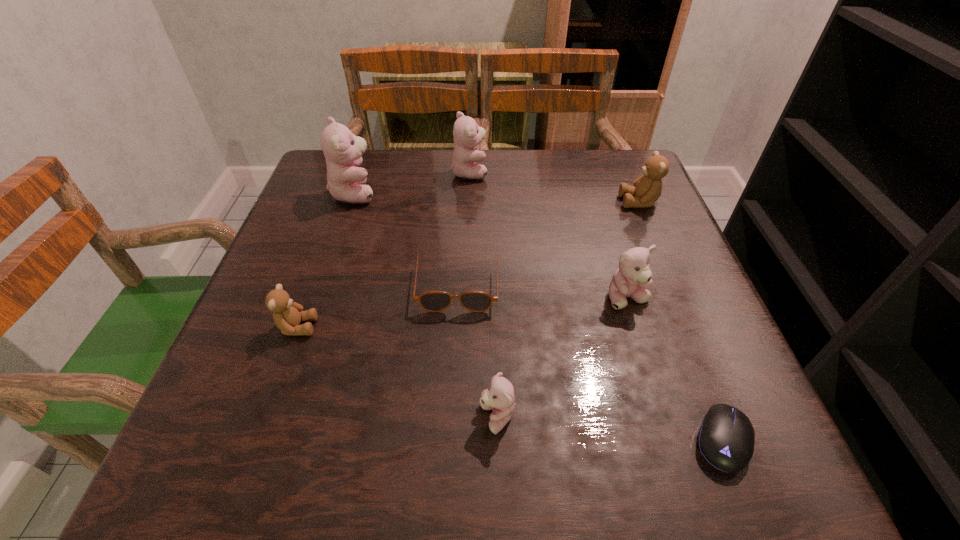
At what (x,y) coordinates should I click in order to perform the action: click on computer mouse located at the right edge. Please return your answer as a coordinate pair (x, y). Looking at the image, I should click on (726, 437).

You are a GUI agent. You are given a task and a screenshot of the screen. Output one action in this format:
    pyautogui.click(x=<x>, y=<y>)
    Task: Click on the object located at the far left corner
    
    Given the screenshot: What is the action you would take?
    pyautogui.click(x=343, y=151)

The width and height of the screenshot is (960, 540). What are the coordinates of `object that is at the far right corner` in the screenshot? It's located at tap(646, 190).

Locate an element on the screen. object present at the near right corner is located at coordinates (726, 437).

The image size is (960, 540). Find the location of `free spot at the far edge of the desktop`. free spot at the far edge of the desktop is located at coordinates (545, 164).

In the image, there is a desktop. Where is `vacant space at the left edge`? vacant space at the left edge is located at coordinates (234, 359).

Locate an element on the screen. free space at the right edge is located at coordinates tap(662, 416).

Locate an element on the screen. vacant space at the far left corner of the desktop is located at coordinates (315, 184).

The image size is (960, 540). Find the location of `blank space at the far right corner of the desktop`. blank space at the far right corner of the desktop is located at coordinates (627, 151).

In order to click on vacant point at the near right corner in this screenshot , I will do `click(697, 463)`.